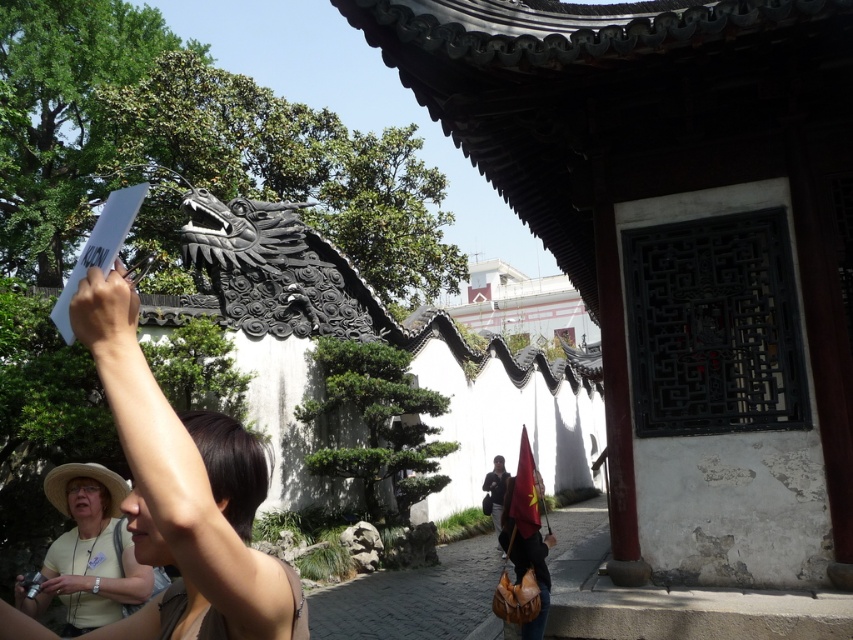
You are organizing a traditional Chinese festival and need to display two fabrics. The yellow fabric at center and the dark blue fabric bag at lower center are available. According to the image, which fabric is placed above the other?

The yellow fabric at center is positioned over the dark blue fabric bag at lower center, meaning it is placed above the dark blue fabric bag at lower center.